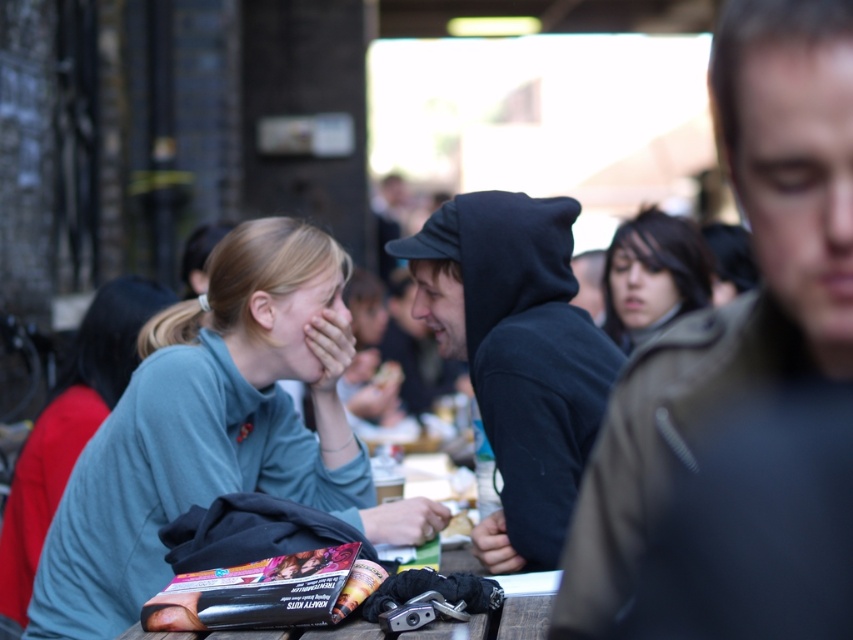
Does dark brown leather jacket at right have a greater width compared to dark brown hair at center?

No, dark brown leather jacket at right is not wider than dark brown hair at center.

Between dark brown leather jacket at right and dark brown hair at center, which one appears on the left side from the viewer's perspective?

Positioned to the left is dark brown leather jacket at right.

Locate an element on the screen. The height and width of the screenshot is (640, 853). dark brown leather jacket at right is located at coordinates (738, 296).

Does point (61, 612) lie in front of point (691, 244)?

Yes.

Who is more distant from viewer, (300, 349) or (665, 317)?

Point (665, 317)

Image resolution: width=853 pixels, height=640 pixels. I want to click on matte green sweater at center, so click(216, 429).

Based on the photo, is matte green sweater at center behind dark brown leather jacket at right?

Yes, it is behind dark brown leather jacket at right.

Is matte green sweater at center to the right of dark brown leather jacket at right from the viewer's perspective?

No, matte green sweater at center is not to the right of dark brown leather jacket at right.

This screenshot has width=853, height=640. What do you see at coordinates (216, 429) in the screenshot? I see `matte green sweater at center` at bounding box center [216, 429].

The height and width of the screenshot is (640, 853). Identify the location of matte green sweater at center. (216, 429).